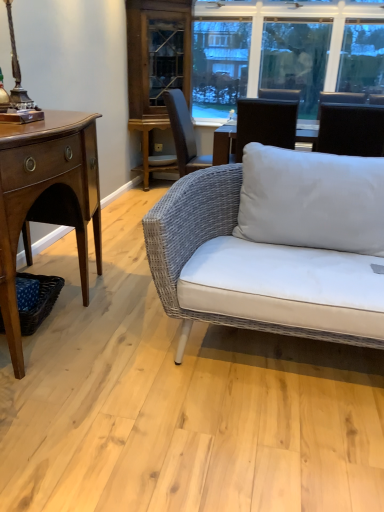
Question: From the image's perspective, is clear glass window at upper center on black fabric chair at upper right?

Choices:
 (A) yes
 (B) no

Answer: (A)

Question: Does clear glass window at upper center lie behind black fabric chair at upper right?

Choices:
 (A) yes
 (B) no

Answer: (A)

Question: Is clear glass window at upper center taller than black fabric chair at upper right?

Choices:
 (A) no
 (B) yes

Answer: (B)

Question: Would you consider clear glass window at upper center to be distant from black fabric chair at upper right?

Choices:
 (A) no
 (B) yes

Answer: (B)

Question: Is clear glass window at upper center in front of black fabric chair at upper right?

Choices:
 (A) no
 (B) yes

Answer: (A)

Question: Is metallic bronze table lamp at upper left in front of or behind clear glass window at upper center in the image?

Choices:
 (A) front
 (B) behind

Answer: (A)

Question: Does point (29, 111) appear closer or farther from the camera than point (256, 27)?

Choices:
 (A) farther
 (B) closer

Answer: (B)

Question: From the image's perspective, is metallic bronze table lamp at upper left located above or below clear glass window at upper center?

Choices:
 (A) below
 (B) above

Answer: (A)

Question: Considering the positions of metallic bronze table lamp at upper left and clear glass window at upper center in the image, is metallic bronze table lamp at upper left wider or thinner than clear glass window at upper center?

Choices:
 (A) thin
 (B) wide

Answer: (B)

Question: Is black fabric chair at upper right to the left or to the right of mahogany wood desk at left in the image?

Choices:
 (A) left
 (B) right

Answer: (B)

Question: In terms of width, does black fabric chair at upper right look wider or thinner when compared to mahogany wood desk at left?

Choices:
 (A) wide
 (B) thin

Answer: (B)

Question: Considering the positions of black fabric chair at upper right and mahogany wood desk at left in the image, is black fabric chair at upper right bigger or smaller than mahogany wood desk at left?

Choices:
 (A) big
 (B) small

Answer: (B)

Question: From a real-world perspective, is black fabric chair at upper right positioned above or below mahogany wood desk at left?

Choices:
 (A) below
 (B) above

Answer: (B)

Question: In the image, is blue woven picnic basket at lower left positioned in front of or behind mahogany wood desk at left?

Choices:
 (A) front
 (B) behind

Answer: (B)

Question: Is point (46, 284) positioned closer to the camera than point (67, 144)?

Choices:
 (A) closer
 (B) farther

Answer: (B)